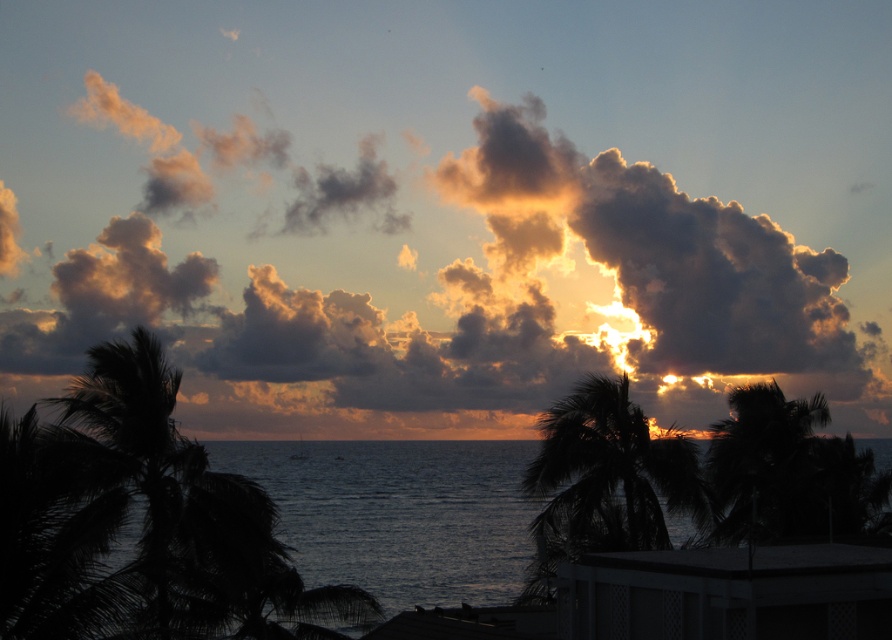
Who is positioned more to the right, golden cotton clouds at upper center or white lattice balcony at lower right?

white lattice balcony at lower right is more to the right.

Who is higher up, golden cotton clouds at upper center or white lattice balcony at lower right?

golden cotton clouds at upper center is higher up.

I want to click on golden cotton clouds at upper center, so click(x=434, y=288).

Is point (385, 545) closer to viewer compared to point (717, 472)?

No, (385, 545) is behind (717, 472).

Between dark blue water at center and dark green leafy palm tree at right, which one is positioned lower?

dark blue water at center is lower down.

Between point (504, 492) and point (745, 445), which one is positioned behind?

The point (504, 492) is behind.

Where is `dark blue water at center`? This screenshot has height=640, width=892. dark blue water at center is located at coordinates (398, 515).

Does silhouette leafy palm at center have a larger size compared to dark green leafy palm tree at right?

Incorrect, silhouette leafy palm at center is not larger than dark green leafy palm tree at right.

Between silhouette leafy palm at center and dark green leafy palm tree at right, which one appears on the left side from the viewer's perspective?

silhouette leafy palm at center

Between point (592, 420) and point (781, 506), which one is positioned in front?

Point (592, 420)

Image resolution: width=892 pixels, height=640 pixels. I want to click on silhouette leafy palm at center, so click(x=609, y=474).